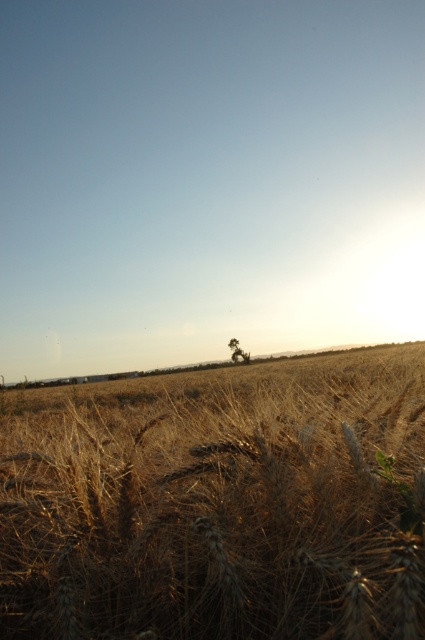
Is brown textured wheat at center bigger than brown textured tree at center?

Yes.

Who is higher up, brown textured wheat at center or brown textured tree at center?

brown textured wheat at center

Does point (54, 417) lie in front of point (235, 355)?

Yes.

Locate an element on the screen. Image resolution: width=425 pixels, height=640 pixels. brown textured wheat at center is located at coordinates (218, 502).